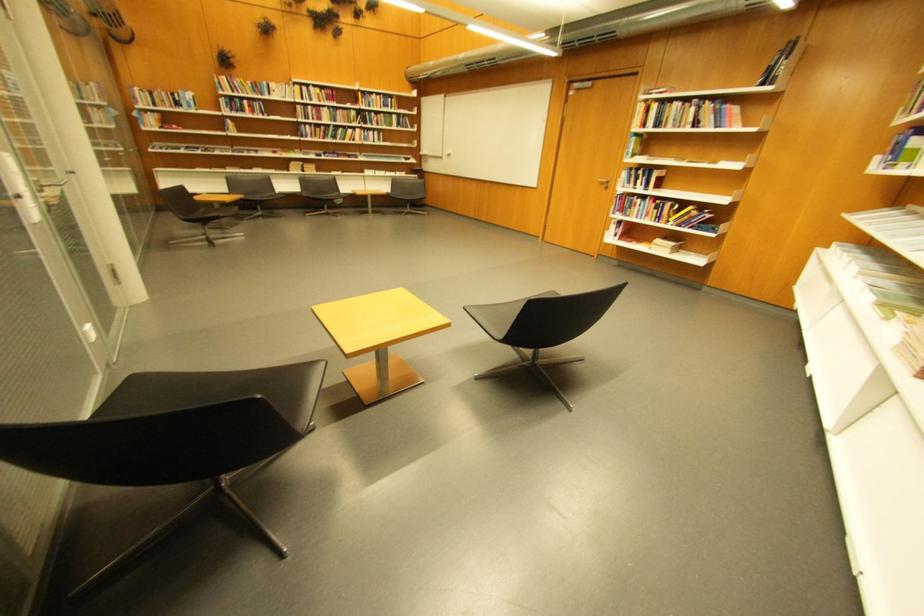
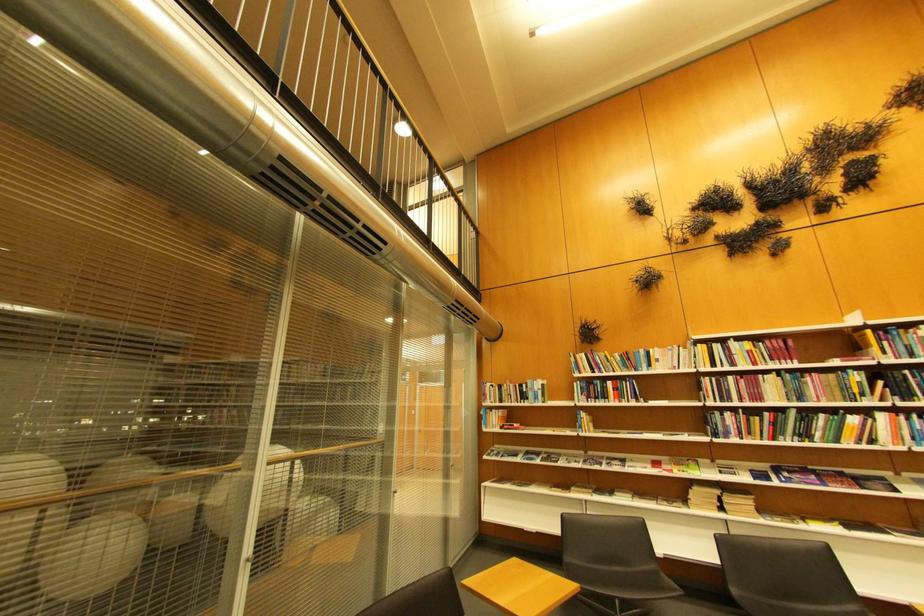
Locate, in the second image, the point that corresponds to point (227, 155) in the first image.

(572, 464)